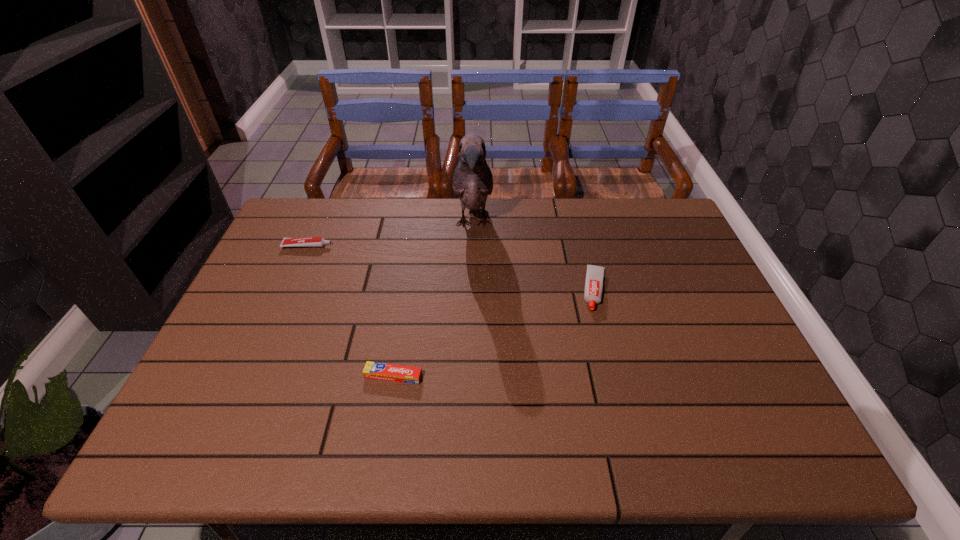
Locate an element on the screen. the tallest object is located at coordinates click(x=472, y=181).

This screenshot has width=960, height=540. What are the coordinates of `the third object from left to right` in the screenshot? It's located at (472, 181).

Locate an element on the screen. The width and height of the screenshot is (960, 540). the second farthest toothpaste is located at coordinates (593, 291).

At what (x,y) coordinates should I click in order to perform the action: click on the rightmost object. Please return your answer as a coordinate pair (x, y). The height and width of the screenshot is (540, 960). Looking at the image, I should click on point(593,291).

Identify the location of the farthest toothpaste. (307, 241).

You are a GUI agent. You are given a task and a screenshot of the screen. Output one action in this format:
    pyautogui.click(x=<x>, y=<y>)
    Task: Click on the leftmost toothpaste
    The height and width of the screenshot is (540, 960).
    Given the screenshot: What is the action you would take?
    pyautogui.click(x=307, y=241)

Where is `the second object from left to right`? This screenshot has height=540, width=960. the second object from left to right is located at coordinates (373, 370).

Where is `the nearest toothpaste`? The image size is (960, 540). the nearest toothpaste is located at coordinates (373, 370).

At what (x,y) coordinates should I click in order to perform the action: click on vacant space located on the front-facing side of the second object from right to left. Please return your answer as a coordinate pair (x, y). Looking at the image, I should click on (471, 341).

Find the location of a particular element. This screenshot has height=540, width=960. vacant space located 0.280m on the left of the third shortest object is located at coordinates (482, 290).